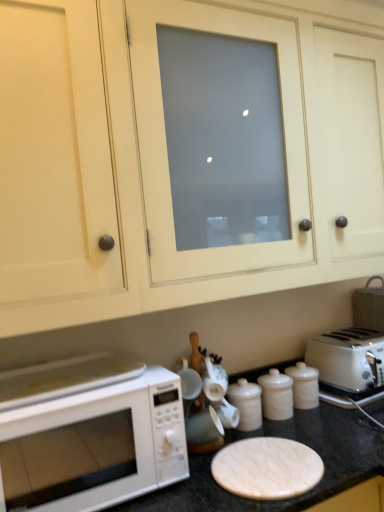
Question: Is white matte microwave at lower left further to camera compared to white plastic toaster at right?

Choices:
 (A) no
 (B) yes

Answer: (A)

Question: Are white matte microwave at lower left and white plastic toaster at right beside each other?

Choices:
 (A) yes
 (B) no

Answer: (B)

Question: Is white matte microwave at lower left to the left of white plastic toaster at right from the viewer's perspective?

Choices:
 (A) yes
 (B) no

Answer: (A)

Question: Is white plastic toaster at right located within white matte microwave at lower left?

Choices:
 (A) no
 (B) yes

Answer: (A)

Question: Would you consider white matte microwave at lower left to be distant from white plastic toaster at right?

Choices:
 (A) yes
 (B) no

Answer: (B)

Question: Is white matte microwave at lower left positioned in front of white plastic toaster at right?

Choices:
 (A) no
 (B) yes

Answer: (B)

Question: Is white marble counter top at lower center facing towards white plastic toaster at right?

Choices:
 (A) no
 (B) yes

Answer: (A)

Question: Does white marble counter top at lower center have a greater width compared to white plastic toaster at right?

Choices:
 (A) no
 (B) yes

Answer: (B)

Question: Is white marble counter top at lower center closer to the viewer compared to white plastic toaster at right?

Choices:
 (A) yes
 (B) no

Answer: (A)

Question: Is white marble counter top at lower center at the left side of white plastic toaster at right?

Choices:
 (A) no
 (B) yes

Answer: (B)

Question: Is white marble counter top at lower center thinner than white plastic toaster at right?

Choices:
 (A) no
 (B) yes

Answer: (A)

Question: Does white marble counter top at lower center have a lesser height compared to white plastic toaster at right?

Choices:
 (A) no
 (B) yes

Answer: (A)

Question: Is white matte microwave at lower left looking in the opposite direction of white glossy canister at center?

Choices:
 (A) yes
 (B) no

Answer: (B)